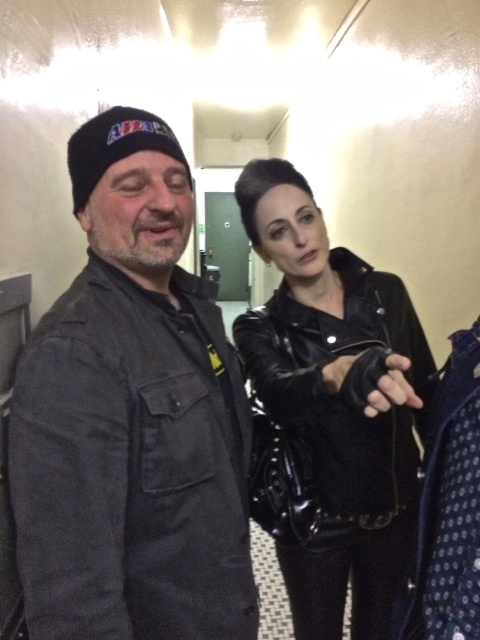
Question: Does dark gray denim jacket at left lie in front of black leather jacket at center?

Choices:
 (A) yes
 (B) no

Answer: (B)

Question: Which point is closer to the camera?

Choices:
 (A) (175, 401)
 (B) (374, 282)

Answer: (A)

Question: Among these points, which one is nearest to the camera?

Choices:
 (A) (47, 420)
 (B) (314, 445)

Answer: (A)

Question: Is dark gray denim jacket at left positioned behind black leather jacket at center?

Choices:
 (A) yes
 (B) no

Answer: (A)

Question: Does dark gray denim jacket at left lie in front of black leather jacket at center?

Choices:
 (A) no
 (B) yes

Answer: (A)